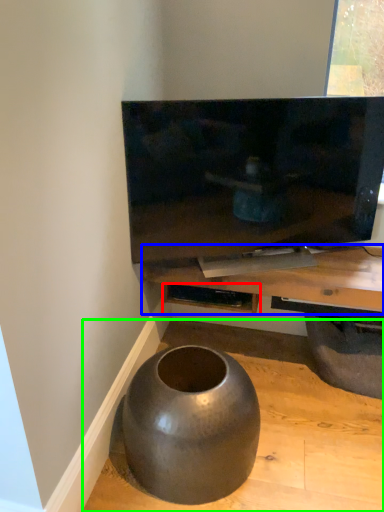
Question: Estimate the real-world distances between objects in this image. Which object is closer to shelf (highlighted by a red box), table (highlighted by a blue box) or concrete (highlighted by a green box)?

Choices:
 (A) table
 (B) concrete

Answer: (A)